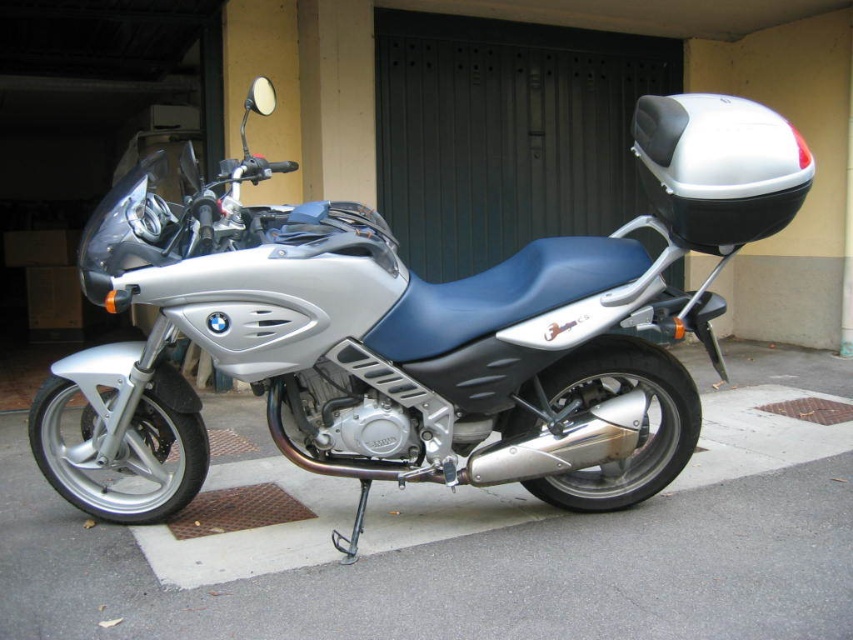
Question: Is silver metallic motorcycle at center below silver asphalt pavement at lower center?

Choices:
 (A) yes
 (B) no

Answer: (B)

Question: Is silver asphalt pavement at lower center below black metal/grey textured garage door at upper center?

Choices:
 (A) no
 (B) yes

Answer: (B)

Question: Which of the following is the farthest from the observer?

Choices:
 (A) (486, 45)
 (B) (202, 420)
 (C) (454, 525)

Answer: (A)

Question: Among these points, which one is nearest to the camera?

Choices:
 (A) (643, 54)
 (B) (108, 272)

Answer: (B)

Question: Can you confirm if silver metallic motorcycle at center is smaller than silver asphalt pavement at lower center?

Choices:
 (A) yes
 (B) no

Answer: (B)

Question: Which point is farther from the camera taking this photo?

Choices:
 (A) (706, 602)
 (B) (405, 248)

Answer: (B)